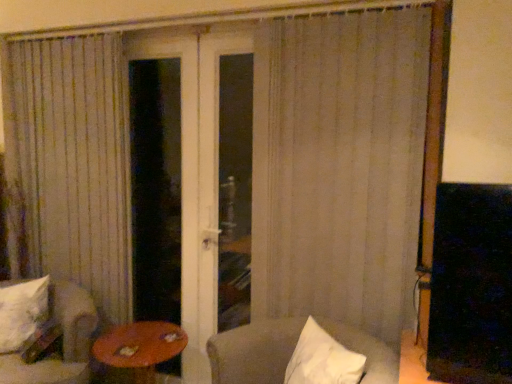
Question: From the image's perspective, is wooden round table at lower left above or below white fabric chair at lower right, placed as the second chair when sorted from left to right?

Choices:
 (A) above
 (B) below

Answer: (B)

Question: Based on their sizes in the image, would you say wooden round table at lower left is bigger or smaller than white fabric chair at lower right, placed as the second chair when sorted from left to right?

Choices:
 (A) big
 (B) small

Answer: (A)

Question: Which object is the farthest from the white textured curtain at center?

Choices:
 (A) white fabric chair at lower left, which is the first chair from left to right
 (B) white soft pillow at lower left
 (C) white fabric chair at lower right, placed as the second chair when sorted from left to right
 (D) wooden round table at lower left
 (E) transparent glass door at center

Answer: (B)

Question: Considering the real-world distances, which object is farthest from the white soft pillow at lower left?

Choices:
 (A) wooden round table at lower left
 (B) white textured curtain at center
 (C) transparent glass door at center
 (D) white fabric chair at lower right, acting as the first chair starting from the right
 (E) white fabric chair at lower left, placed as the 2th chair when sorted from right to left

Answer: (B)